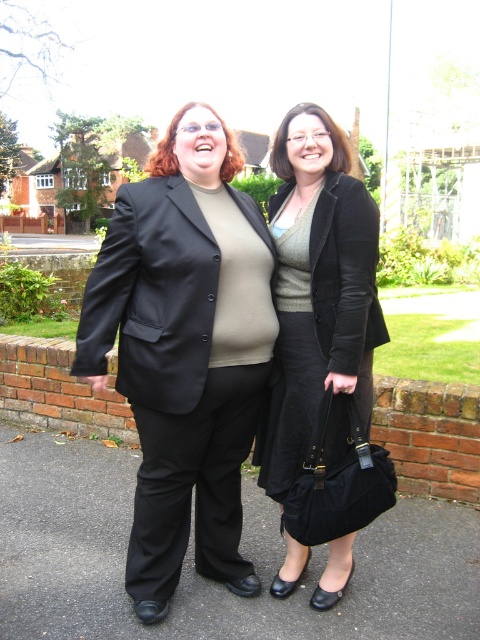
Is black smooth blazer at center below matte black skirt at center?

Yes, black smooth blazer at center is below matte black skirt at center.

Does point (192, 454) come behind point (280, 360)?

No, it is in front of (280, 360).

Locate an element on the screen. The height and width of the screenshot is (640, 480). black smooth blazer at center is located at coordinates (171, 381).